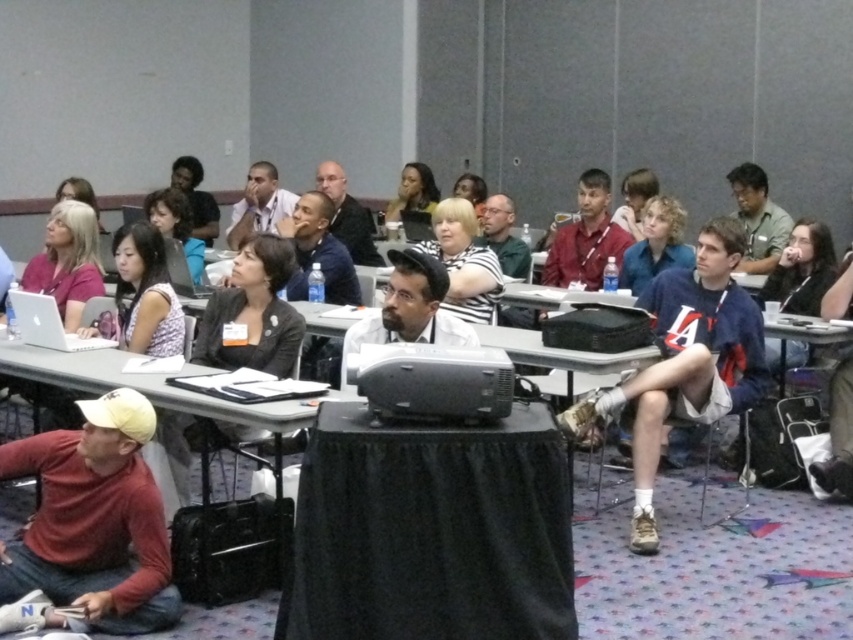
Which is behind, point (387, 435) or point (65, 323)?

The point (65, 323) is behind.

Does point (395, 444) lie in front of point (39, 285)?

Yes, it is in front of point (39, 285).

Is point (405, 429) less distant than point (91, 268)?

Yes, it is.

Where is `black fabric table at center`? The height and width of the screenshot is (640, 853). black fabric table at center is located at coordinates (430, 531).

Does point (451, 612) come closer to viewer compared to point (659, 298)?

Yes.

Between black fabric table at center and blue cotton shirt at center, which one has more height?

With more height is blue cotton shirt at center.

What do you see at coordinates (430, 531) in the screenshot? I see `black fabric table at center` at bounding box center [430, 531].

Locate an element on the screen. black fabric table at center is located at coordinates (430, 531).

Does point (61, 557) come behind point (416, 189)?

No, (61, 557) is closer to viewer.

The width and height of the screenshot is (853, 640). I want to click on matte red shirt at lower left, so coord(94,518).